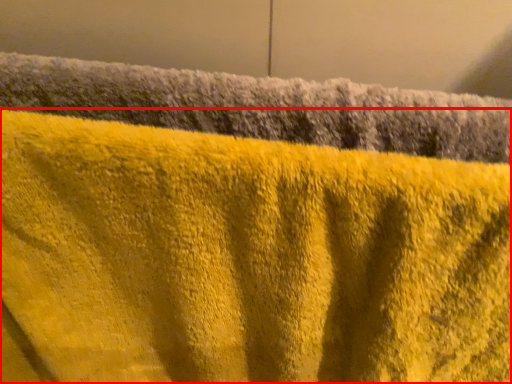
Question: From the image's perspective, where is towel (annotated by the red box) located in relation to towel in the image?

Choices:
 (A) below
 (B) above

Answer: (A)